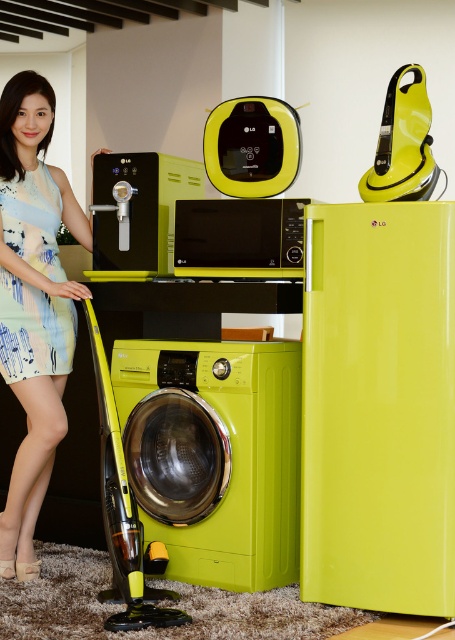
Is glossy lime green washing machine at lower center shorter than light blue printed dress at left?

No, glossy lime green washing machine at lower center is not shorter than light blue printed dress at left.

Is the position of glossy lime green washing machine at lower center less distant than that of light blue printed dress at left?

Yes, glossy lime green washing machine at lower center is closer to the viewer.

Where is `glossy lime green washing machine at lower center`? The width and height of the screenshot is (455, 640). glossy lime green washing machine at lower center is located at coordinates (215, 456).

Consider the image. Is printed fabric dress at lower left smaller than matte black microwave at center?

No, printed fabric dress at lower left is not smaller than matte black microwave at center.

Which is above, printed fabric dress at lower left or matte black microwave at center?

matte black microwave at center is above.

At what (x,y) coordinates should I click in order to perform the action: click on printed fabric dress at lower left. Please return your answer as a coordinate pair (x, y). Looking at the image, I should click on (34, 305).

Who is more forward, (51,115) or (29,348)?

Point (29,348)

Is printed fabric dress at lower left shorter than light blue printed dress at left?

No, printed fabric dress at lower left is not shorter than light blue printed dress at left.

Describe the element at coordinates (34, 305) in the screenshot. I see `printed fabric dress at lower left` at that location.

Identify the location of printed fabric dress at lower left. (34, 305).